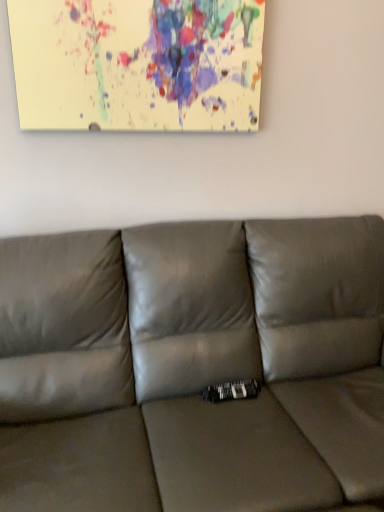
Question: Are satin gray couch at center and paint splatter canvas at upper center located far from each other?

Choices:
 (A) yes
 (B) no

Answer: (B)

Question: Is paint splatter canvas at upper center at the back of satin gray couch at center?

Choices:
 (A) no
 (B) yes

Answer: (A)

Question: Does satin gray couch at center turn towards paint splatter canvas at upper center?

Choices:
 (A) no
 (B) yes

Answer: (A)

Question: Considering the relative sizes of satin gray couch at center and paint splatter canvas at upper center in the image provided, is satin gray couch at center taller than paint splatter canvas at upper center?

Choices:
 (A) yes
 (B) no

Answer: (A)

Question: Would you say paint splatter canvas at upper center is part of satin gray couch at center's contents?

Choices:
 (A) no
 (B) yes

Answer: (A)

Question: Can you confirm if satin gray couch at center is shorter than paint splatter canvas at upper center?

Choices:
 (A) yes
 (B) no

Answer: (B)

Question: Can you confirm if paint splatter canvas at upper center is bigger than satin gray couch at center?

Choices:
 (A) no
 (B) yes

Answer: (A)

Question: Is paint splatter canvas at upper center located outside satin gray couch at center?

Choices:
 (A) no
 (B) yes

Answer: (B)

Question: Considering the relative sizes of paint splatter canvas at upper center and satin gray couch at center in the image provided, is paint splatter canvas at upper center thinner than satin gray couch at center?

Choices:
 (A) no
 (B) yes

Answer: (B)

Question: Can you confirm if paint splatter canvas at upper center is smaller than satin gray couch at center?

Choices:
 (A) yes
 (B) no

Answer: (A)

Question: Can you confirm if paint splatter canvas at upper center is taller than satin gray couch at center?

Choices:
 (A) no
 (B) yes

Answer: (A)

Question: Does paint splatter canvas at upper center turn towards satin gray couch at center?

Choices:
 (A) no
 (B) yes

Answer: (A)

Question: Is paint splatter canvas at upper center spatially inside satin gray couch at center, or outside of it?

Choices:
 (A) inside
 (B) outside

Answer: (B)